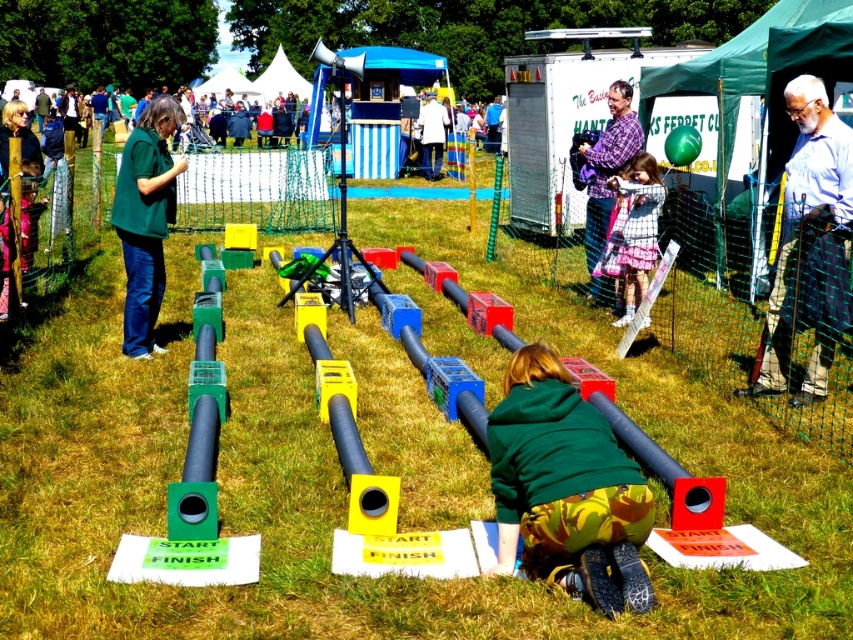
Question: Observing the image, what is the correct spatial positioning of plaid fabric dress at center in reference to green fabric jacket at center?

Choices:
 (A) above
 (B) below

Answer: (B)

Question: Can you confirm if plaid fabric dress at center is smaller than green fabric jacket at center?

Choices:
 (A) no
 (B) yes

Answer: (A)

Question: Among these objects, which one is farthest from the camera?

Choices:
 (A) green matte hoodie at center
 (B) blue plaid kilt at right

Answer: (B)

Question: Which point appears farthest from the camera in this image?

Choices:
 (A) (122, 234)
 (B) (595, 180)
 (C) (648, 586)

Answer: (B)

Question: Does green matte jacket at left have a lesser width compared to plaid fabric dress at center?

Choices:
 (A) yes
 (B) no

Answer: (B)

Question: Among these objects, which one is farthest from the camera?

Choices:
 (A) blue plaid kilt at right
 (B) green matte hoodie at center

Answer: (A)